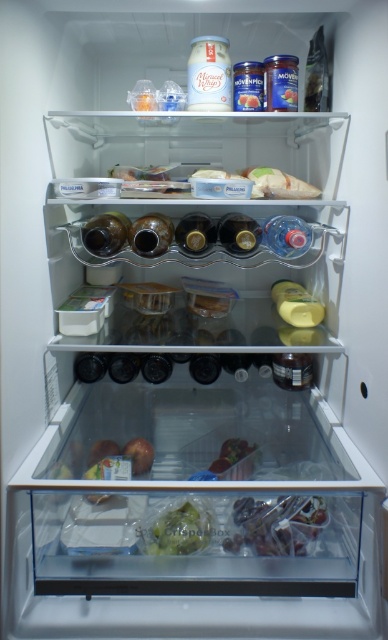
Question: Considering the relative positions of translucent plastic bag at lower center and green matte crisper box at lower center in the image provided, where is translucent plastic bag at lower center located with respect to green matte crisper box at lower center?

Choices:
 (A) above
 (B) below

Answer: (A)

Question: Does green matte crisper box at lower center have a smaller size compared to shiny plastic container at center?

Choices:
 (A) yes
 (B) no

Answer: (A)

Question: Observing the image, what is the correct spatial positioning of translucent plastic bag at lower center in reference to shiny plastic container at center?

Choices:
 (A) below
 (B) above

Answer: (A)

Question: Which object appears closest to the camera in this image?

Choices:
 (A) green matte crisper box at lower center
 (B) translucent plastic bag at lower center

Answer: (A)

Question: Which point is farther to the camera?

Choices:
 (A) green matte crisper box at lower center
 (B) translucent plastic bag at lower center
 (C) shiny plastic container at center

Answer: (C)

Question: Which point is closer to the camera?

Choices:
 (A) (180, 508)
 (B) (254, 545)

Answer: (B)